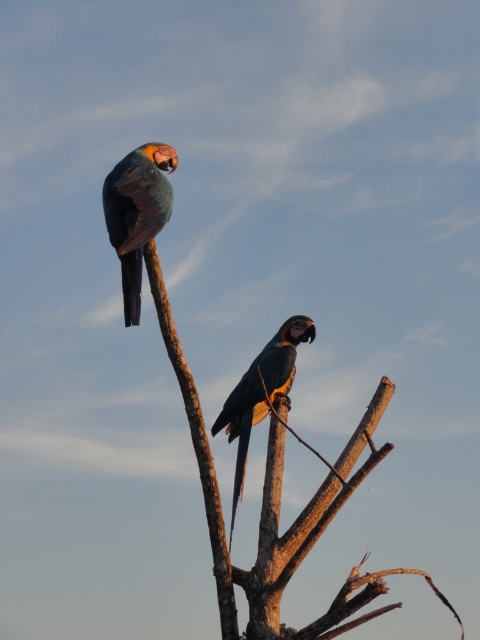
Who is more forward, (264, 481) or (139, 209)?

Positioned in front is point (139, 209).

Does brown rough tree trunk at center appear over shiny blue-green parrot at upper left?

Incorrect, brown rough tree trunk at center is not positioned above shiny blue-green parrot at upper left.

Find the location of a particular element. The height and width of the screenshot is (640, 480). brown rough tree trunk at center is located at coordinates (262, 500).

Does brown rough tree trunk at center appear on the left side of shiny blue parrot at center?

In fact, brown rough tree trunk at center is to the right of shiny blue parrot at center.

You are a GUI agent. You are given a task and a screenshot of the screen. Output one action in this format:
    pyautogui.click(x=<x>, y=<y>)
    Task: Click on the brown rough tree trunk at center
    This screenshot has width=480, height=640.
    Given the screenshot: What is the action you would take?
    pyautogui.click(x=262, y=500)

Describe the element at coordinates (136, 212) in the screenshot. I see `shiny blue-green parrot at upper left` at that location.

In the scene shown: Who is more forward, (131, 248) or (242, 417)?

Point (131, 248) is more forward.

Where is `shiny blue-green parrot at upper left`? The height and width of the screenshot is (640, 480). shiny blue-green parrot at upper left is located at coordinates (136, 212).